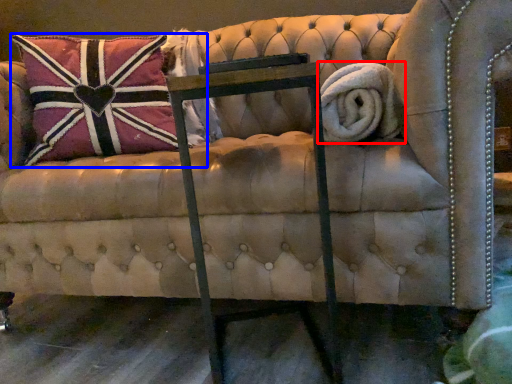
Question: Which of the following is the closest to the observer, bath towel (highlighted by a red box) or pillow (highlighted by a blue box)?

Choices:
 (A) bath towel
 (B) pillow

Answer: (A)